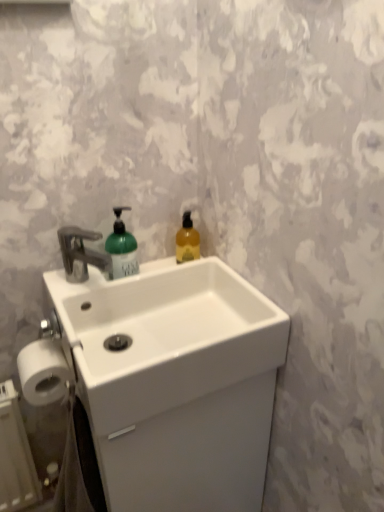
Question: Is white matte toilet paper at lower left at the left side of translucent amber liquid at upper right, the first bottle in the right-to-left sequence?

Choices:
 (A) yes
 (B) no

Answer: (A)

Question: Could translucent amber liquid at upper right, acting as the 2th bottle starting from the left, be considered to be inside white matte toilet paper at lower left?

Choices:
 (A) no
 (B) yes

Answer: (A)

Question: Are white matte toilet paper at lower left and translucent amber liquid at upper right, the first bottle in the right-to-left sequence, making contact?

Choices:
 (A) yes
 (B) no

Answer: (B)

Question: Is white matte toilet paper at lower left further to camera compared to translucent amber liquid at upper right, acting as the 2th bottle starting from the left?

Choices:
 (A) no
 (B) yes

Answer: (A)

Question: Is white matte toilet paper at lower left positioned beyond the bounds of translucent amber liquid at upper right, the first bottle in the right-to-left sequence?

Choices:
 (A) no
 (B) yes

Answer: (B)

Question: From a real-world perspective, is white matte toilet paper at lower left on translucent amber liquid at upper right, acting as the 2th bottle starting from the left?

Choices:
 (A) no
 (B) yes

Answer: (A)

Question: Does green matte bottle at center, arranged as the 2th bottle when viewed from the right, touch white matte toilet paper at lower left?

Choices:
 (A) yes
 (B) no

Answer: (B)

Question: Is white matte toilet paper at lower left completely or partially inside green matte bottle at center, arranged as the 2th bottle when viewed from the right?

Choices:
 (A) no
 (B) yes

Answer: (A)

Question: From a real-world perspective, is green matte bottle at center, the first bottle viewed from the left, beneath white matte toilet paper at lower left?

Choices:
 (A) yes
 (B) no

Answer: (B)

Question: From a real-world perspective, is green matte bottle at center, the first bottle viewed from the left, on white matte toilet paper at lower left?

Choices:
 (A) no
 (B) yes

Answer: (B)

Question: Is green matte bottle at center, the first bottle viewed from the left, positioned behind white matte toilet paper at lower left?

Choices:
 (A) yes
 (B) no

Answer: (A)

Question: Does green matte bottle at center, arranged as the 2th bottle when viewed from the right, have a lesser height compared to white matte toilet paper at lower left?

Choices:
 (A) no
 (B) yes

Answer: (A)

Question: Is white ceramic sink at center facing away from white matte toilet paper at lower left?

Choices:
 (A) yes
 (B) no

Answer: (B)